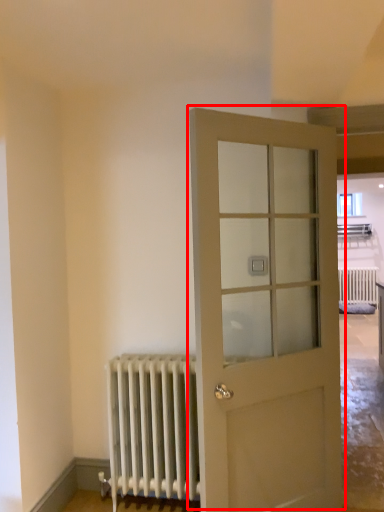
Question: From the image's perspective, what is the correct spatial positioning of door (annotated by the red box) in reference to radiator?

Choices:
 (A) above
 (B) below

Answer: (A)